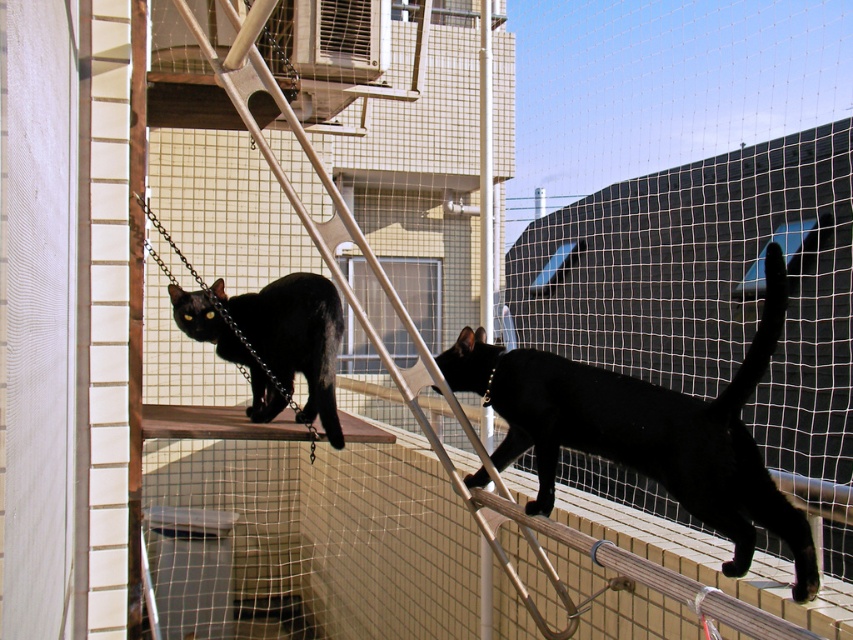
Describe the element at coordinates (646, 429) in the screenshot. I see `black glossy cat at upper right` at that location.

Is black glossy cat at upper right to the left of matte black cat at upper left from the viewer's perspective?

In fact, black glossy cat at upper right is to the right of matte black cat at upper left.

You are a GUI agent. You are given a task and a screenshot of the screen. Output one action in this format:
    pyautogui.click(x=<x>, y=<y>)
    Task: Click on the black glossy cat at upper right
    The width and height of the screenshot is (853, 640).
    Given the screenshot: What is the action you would take?
    pyautogui.click(x=646, y=429)